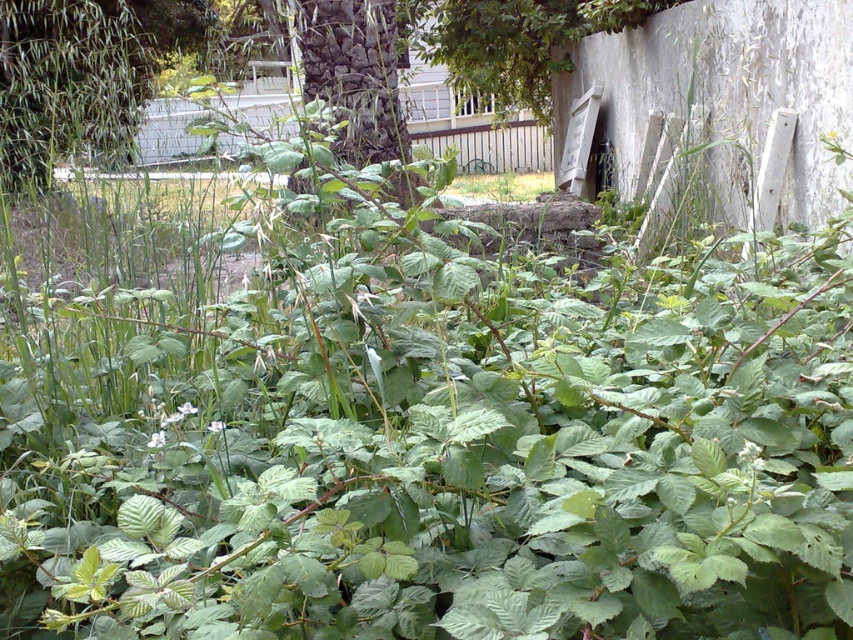
Based on the photo, who is positioned more to the left, dark brown textured tree trunk at center or green leafy grass at center?

dark brown textured tree trunk at center is more to the left.

Does dark brown textured tree trunk at center have a smaller size compared to green leafy grass at center?

Indeed, dark brown textured tree trunk at center has a smaller size compared to green leafy grass at center.

This screenshot has height=640, width=853. Identify the location of dark brown textured tree trunk at center. (352, 74).

Identify the location of dark brown textured tree trunk at center. This screenshot has width=853, height=640. (352, 74).